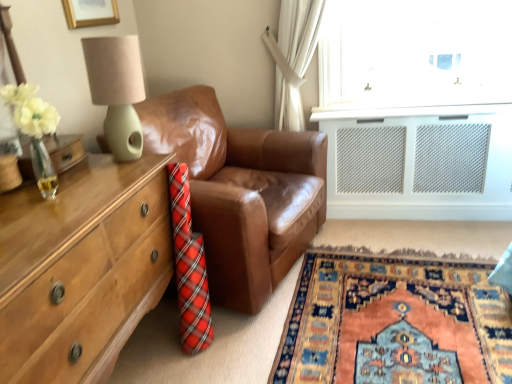
Where is `vacant space underneath matte green lamp at upper left (from a real-world perspective)`? This screenshot has height=384, width=512. vacant space underneath matte green lamp at upper left (from a real-world perspective) is located at coordinates (121, 163).